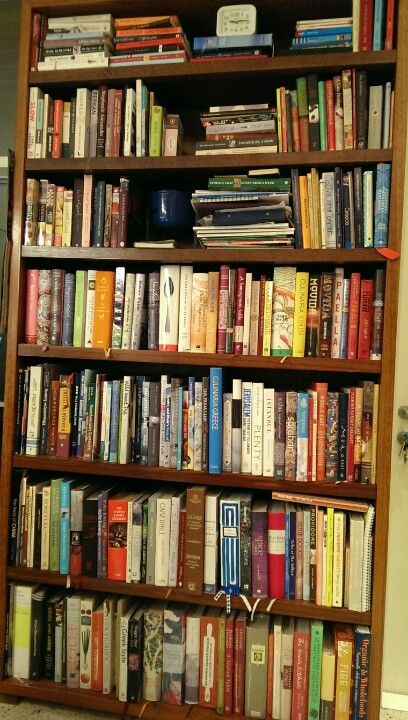
Image resolution: width=408 pixels, height=720 pixels. What are the coordinates of `book shelf` in the screenshot? It's located at click(x=194, y=67), click(x=192, y=155), click(x=187, y=250), click(x=196, y=359), click(x=196, y=480), click(x=182, y=605), click(x=95, y=697).